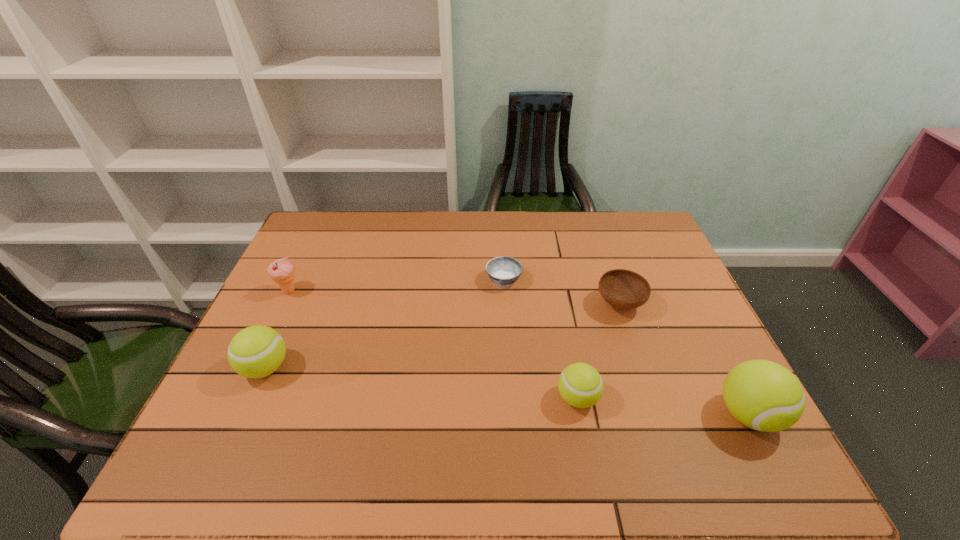
Locate an element on the screen. This screenshot has height=540, width=960. object located at the near right corner is located at coordinates (765, 396).

Image resolution: width=960 pixels, height=540 pixels. Find the location of `free space at the far edge of the desktop`. free space at the far edge of the desktop is located at coordinates (603, 224).

I want to click on free space at the near edge, so click(648, 415).

The height and width of the screenshot is (540, 960). In the image, there is a desktop. Identify the location of vacant space at the left edge. (281, 318).

The image size is (960, 540). In the image, there is a desktop. What are the coordinates of `vacant space at the right edge` in the screenshot? It's located at (647, 253).

This screenshot has height=540, width=960. What are the coordinates of `vacant area at the far right corner of the desktop` in the screenshot? It's located at (621, 224).

You are a GUI agent. You are given a task and a screenshot of the screen. Output one action in this format:
    pyautogui.click(x=<x>, y=<y>)
    Task: Click on the empty space between the second tennis ball from left to right and the second tallest tennis ball
    This screenshot has width=960, height=540.
    Given the screenshot: What is the action you would take?
    pyautogui.click(x=421, y=383)

You are a GUI agent. You are given a task and a screenshot of the screen. Output one action in this format:
    pyautogui.click(x=<x>, y=<y>)
    Task: Click on the free space between the second tennis ball from right to left and the leftmost tennis ball
    This screenshot has height=540, width=960.
    Given the screenshot: What is the action you would take?
    pyautogui.click(x=421, y=383)

This screenshot has height=540, width=960. I want to click on free spot between the shortest tennis ball and the icecream, so click(433, 345).

At what (x,y) coordinates should I click in order to perform the action: click on vacant space that's between the second shortest object and the leftmost tennis ball. Please return your answer as a coordinate pair (x, y). This screenshot has width=960, height=540. Looking at the image, I should click on click(x=443, y=336).